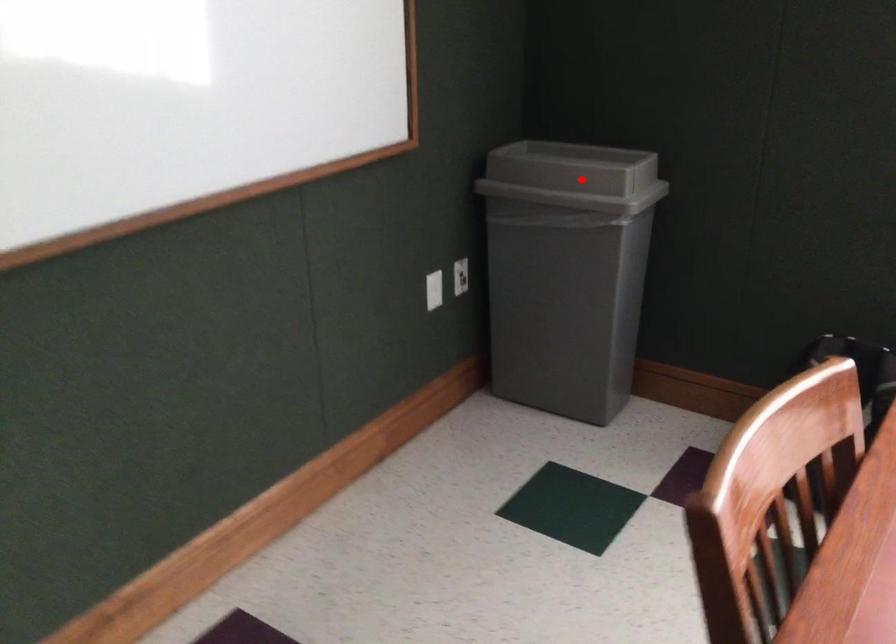
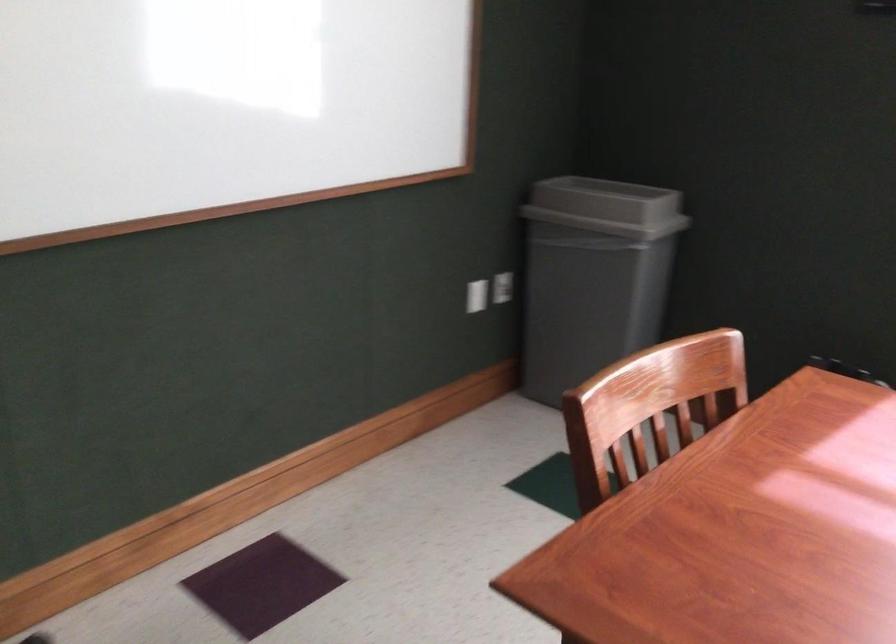
Question: I am providing you with two images of the same scene from different viewpoints. Given a red point in image1, look at the same physical point in image2. Is it:

Choices:
 (A) Closer to the viewpoint
 (B) Farther from the viewpoint

Answer: (B)